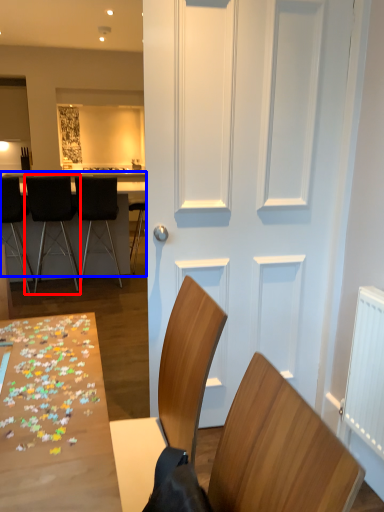
Question: Which point is closer to the camera, chair (highlighted by a red box) or table (highlighted by a blue box)?

Choices:
 (A) chair
 (B) table

Answer: (B)